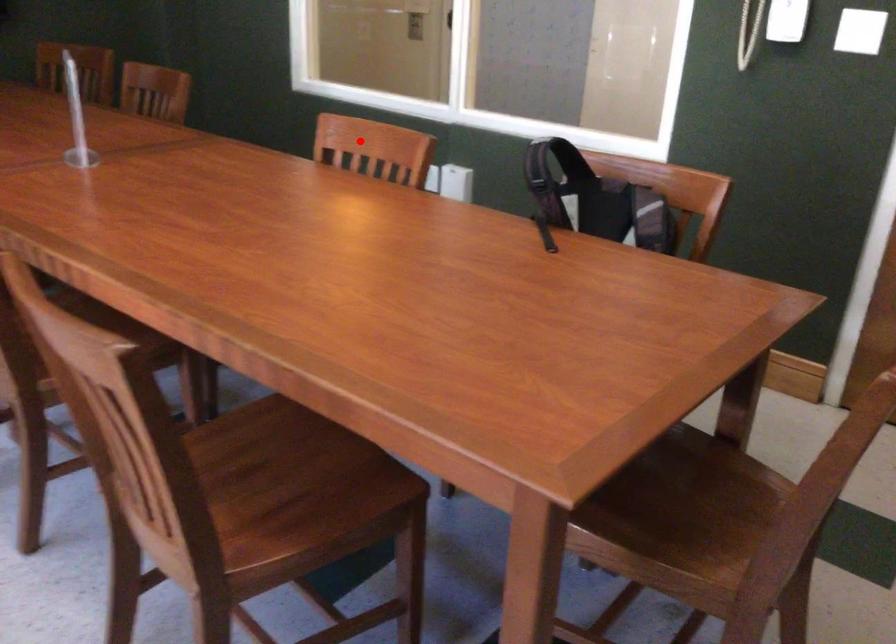
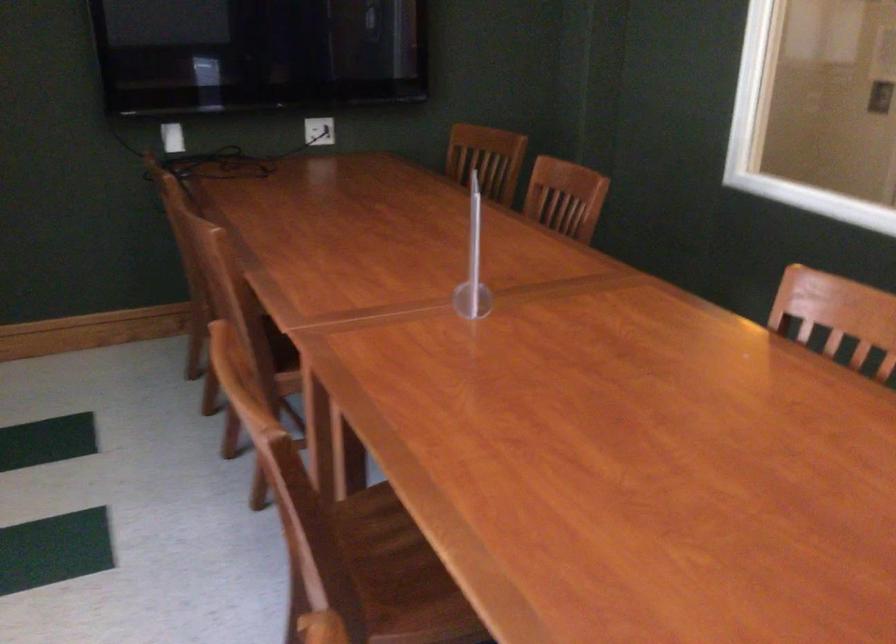
Question: A red point is marked in image1. In image2, is the corresponding 3D point closer to the camera or farther? Reply with the corresponding letter.

Choices:
 (A) The corresponding 3D point is closer.
 (B) The corresponding 3D point is farther.

Answer: (A)